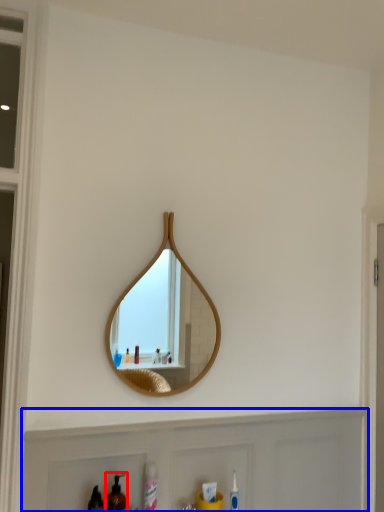
Question: Which of the following is the farthest to the observer, mouthwash (highlighted by a red box) or cabinet (highlighted by a blue box)?

Choices:
 (A) mouthwash
 (B) cabinet

Answer: (B)